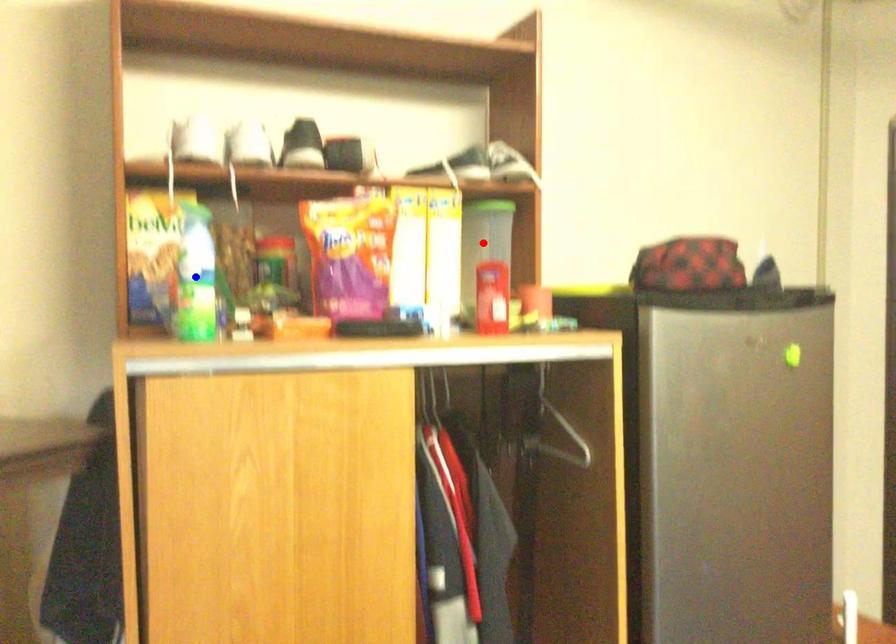
Question: In the image, two points are highlighted. Which point is nearer to the camera? Reply with the corresponding letter.

Choices:
 (A) blue point
 (B) red point

Answer: (A)